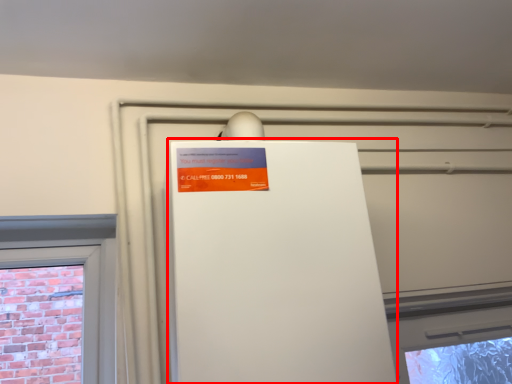
Question: Considering the relative positions of appliance (annotated by the red box) and advertisement in the image provided, where is appliance (annotated by the red box) located with respect to the staircase?

Choices:
 (A) left
 (B) right

Answer: (B)